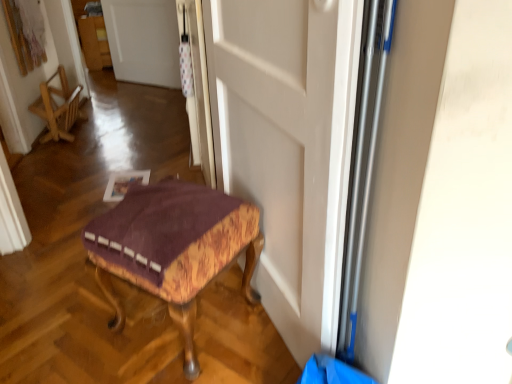
I want to click on velvet purple cushioned stool at lower center, so click(174, 248).

Where is `white glossy door at upper center, which is the second door in front-to-back order`? Image resolution: width=512 pixels, height=384 pixels. white glossy door at upper center, which is the second door in front-to-back order is located at coordinates (143, 41).

Would you say velvet purple cushioned stool at lower center contains white matte door at center, the first door from the right?

No, white matte door at center, the first door from the right, is not a part of velvet purple cushioned stool at lower center.

From the image's perspective, is velvet purple cushioned stool at lower center above white matte door at center, the first door from the right?

No.

Can you confirm if velvet purple cushioned stool at lower center is thinner than white matte door at center, the second door when ordered from top to bottom?

No, velvet purple cushioned stool at lower center is not thinner than white matte door at center, the second door when ordered from top to bottom.

From a real-world perspective, is velvet purple cushioned stool at lower center on white matte door at center, which is the 1th door in bottom-to-top order?

No, from a real-world perspective, velvet purple cushioned stool at lower center is not above white matte door at center, which is the 1th door in bottom-to-top order.

Which object is positioned more to the left, white glossy door at upper center, which ranks as the first door in left-to-right order, or wooden chair at left?

wooden chair at left.

Between point (116, 55) and point (61, 93), which one is positioned in front?

The point (61, 93) is closer.

Who is taller, white glossy door at upper center, which ranks as the first door in left-to-right order, or wooden chair at left?

white glossy door at upper center, which ranks as the first door in left-to-right order.

Does white glossy door at upper center, arranged as the 2th door when viewed from the right, turn towards wooden chair at left?

Yes.

Visually, is white glossy door at upper center, which is the first door from top to bottom, positioned to the left or to the right of white matte door at center, the second door positioned from the left?

white glossy door at upper center, which is the first door from top to bottom, is to the left of white matte door at center, the second door positioned from the left.

From a real-world perspective, is white glossy door at upper center, arranged as the 2th door when viewed from the right, physically located above or below white matte door at center, the first door from the right?

In terms of real-world spatial position, white glossy door at upper center, arranged as the 2th door when viewed from the right, is below white matte door at center, the first door from the right.

Which of these two, white glossy door at upper center, which ranks as the first door in left-to-right order, or white matte door at center, the second door when ordered from top to bottom, is smaller?

Smaller between the two is white glossy door at upper center, which ranks as the first door in left-to-right order.

Considering the relative sizes of velvet purple cushioned stool at lower center and white glossy door at upper center, which ranks as the first door in left-to-right order, in the image provided, is velvet purple cushioned stool at lower center taller than white glossy door at upper center, which ranks as the first door in left-to-right order,?

No.

Which point is more forward, [104,224] or [149,66]?

The point [104,224] is in front.

Does velvet purple cushioned stool at lower center have a larger size compared to white glossy door at upper center, positioned as the first door in back-to-front order?

Yes.

From a real-world perspective, is velvet purple cushioned stool at lower center on top of white glossy door at upper center, arranged as the 2th door when viewed from the right?

Actually, velvet purple cushioned stool at lower center is physically below white glossy door at upper center, arranged as the 2th door when viewed from the right, in the real world.

From the image's perspective, is white matte door at center, which is counted as the first door, starting from the front, on top of white glossy door at upper center, which is the second door in front-to-back order?

No, from the image's perspective, white matte door at center, which is counted as the first door, starting from the front, is not on top of white glossy door at upper center, which is the second door in front-to-back order.

Choose the correct answer: Is white matte door at center, the second door when ordered from top to bottom, inside white glossy door at upper center, the second door ordered from the bottom, or outside it?

white matte door at center, the second door when ordered from top to bottom, is not enclosed by white glossy door at upper center, the second door ordered from the bottom.

In terms of height, does white matte door at center, which ranks as the second door in back-to-front order, look taller or shorter compared to white glossy door at upper center, which ranks as the first door in left-to-right order?

Considering their sizes, white matte door at center, which ranks as the second door in back-to-front order, has more height than white glossy door at upper center, which ranks as the first door in left-to-right order.

Is white matte door at center, the first door from the right, in front of or behind white glossy door at upper center, positioned as the first door in back-to-front order, in the image?

white matte door at center, the first door from the right, is in front of white glossy door at upper center, positioned as the first door in back-to-front order.

From a real-world perspective, is velvet purple cushioned stool at lower center on wooden chair at left?

Yes.

Is velvet purple cushioned stool at lower center completely or partially outside of wooden chair at left?

Indeed, velvet purple cushioned stool at lower center is completely outside wooden chair at left.

Which of these two, velvet purple cushioned stool at lower center or wooden chair at left, stands shorter?

wooden chair at left is shorter.

Is wooden chair at left bigger than velvet purple cushioned stool at lower center?

Incorrect, wooden chair at left is not larger than velvet purple cushioned stool at lower center.

Is wooden chair at left outside of velvet purple cushioned stool at lower center?

Yes.

Is there a large distance between wooden chair at left and velvet purple cushioned stool at lower center?

That's right, there is a large distance between wooden chair at left and velvet purple cushioned stool at lower center.

How far apart are wooden chair at left and velvet purple cushioned stool at lower center?

A distance of 1.92 meters exists between wooden chair at left and velvet purple cushioned stool at lower center.

I want to click on door in front of the velvet purple cushioned stool at lower center, so click(288, 146).

The image size is (512, 384). I want to click on door behind the wooden chair at left, so click(143, 41).

Estimate the real-world distances between objects in this image. Which object is further from wooden chair at left, white glossy door at upper center, positioned as the first door in back-to-front order, or velvet purple cushioned stool at lower center?

velvet purple cushioned stool at lower center lies further to wooden chair at left than the other object.

In the scene shown: When comparing their distances from white matte door at center, which is the 1th door in bottom-to-top order, does velvet purple cushioned stool at lower center or wooden chair at left seem closer?

The object closer to white matte door at center, which is the 1th door in bottom-to-top order, is velvet purple cushioned stool at lower center.

When comparing their distances from velvet purple cushioned stool at lower center, does white glossy door at upper center, arranged as the 2th door when viewed from the right, or wooden chair at left seem closer?

Based on the image, wooden chair at left appears to be nearer to velvet purple cushioned stool at lower center.

Which object lies further to the anchor point white glossy door at upper center, which ranks as the first door in left-to-right order, velvet purple cushioned stool at lower center or wooden chair at left?

The object further to white glossy door at upper center, which ranks as the first door in left-to-right order, is velvet purple cushioned stool at lower center.

Based on their spatial positions, is wooden chair at left or white matte door at center, which is the 1th door in bottom-to-top order, further from white glossy door at upper center, which is the first door from top to bottom?

Based on the image, white matte door at center, which is the 1th door in bottom-to-top order, appears to be further to white glossy door at upper center, which is the first door from top to bottom.

Looking at the image, which one is located further to velvet purple cushioned stool at lower center, white matte door at center, the first door from the right, or wooden chair at left?

wooden chair at left is positioned further to the anchor velvet purple cushioned stool at lower center.

Considering their positions, is wooden chair at left positioned further to white matte door at center, which ranks as the second door in back-to-front order, than velvet purple cushioned stool at lower center?

Based on the image, wooden chair at left appears to be further to white matte door at center, which ranks as the second door in back-to-front order.

Based on their spatial positions, is velvet purple cushioned stool at lower center or white matte door at center, the second door positioned from the left, closer to wooden chair at left?

velvet purple cushioned stool at lower center lies closer to wooden chair at left than the other object.

Where is `chair positioned between white matte door at center, the second door when ordered from top to bottom, and white glossy door at upper center, which is the first door from top to bottom, from near to far`? This screenshot has width=512, height=384. chair positioned between white matte door at center, the second door when ordered from top to bottom, and white glossy door at upper center, which is the first door from top to bottom, from near to far is located at coordinates (58, 107).

Where is `chair between velvet purple cushioned stool at lower center and white glossy door at upper center, the second door ordered from the bottom, in the front-back direction`? This screenshot has height=384, width=512. chair between velvet purple cushioned stool at lower center and white glossy door at upper center, the second door ordered from the bottom, in the front-back direction is located at coordinates (58, 107).

Image resolution: width=512 pixels, height=384 pixels. What are the coordinates of `furniture between white matte door at center, the second door positioned from the left, and wooden chair at left in the front-back direction` in the screenshot? It's located at (174, 248).

The width and height of the screenshot is (512, 384). In order to click on furniture between white matte door at center, the second door when ordered from top to bottom, and white glossy door at upper center, positioned as the first door in back-to-front order, from front to back in this screenshot , I will do `click(174, 248)`.